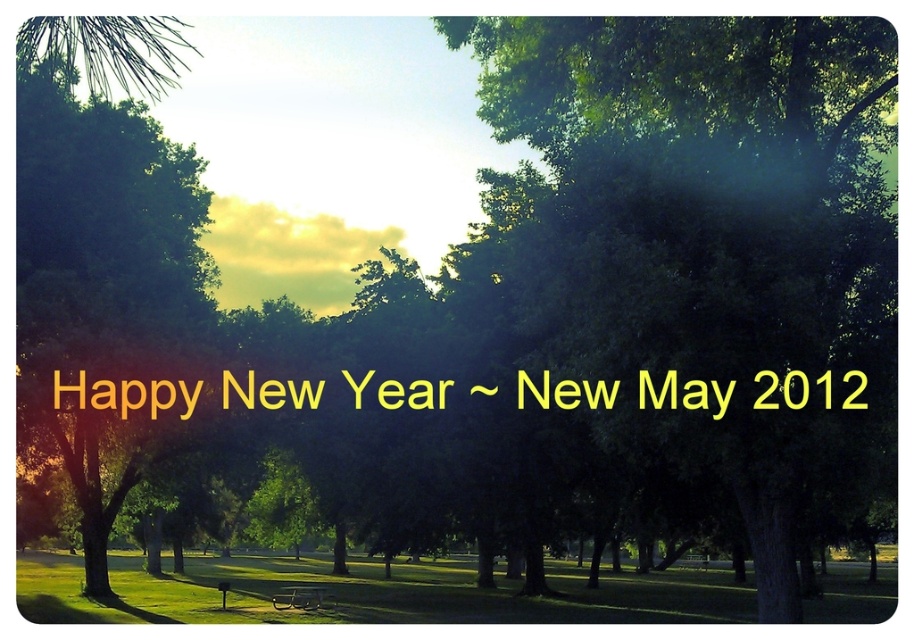
Does yellow metallic text at center lie behind wooden park bench at lower center?

No, it is in front of wooden park bench at lower center.

From the picture: Can you confirm if yellow metallic text at center is smaller than wooden park bench at lower center?

No.

Which is in front, point (126, 380) or point (319, 589)?

Point (126, 380) is in front.

The width and height of the screenshot is (914, 640). Find the location of `yellow metallic text at center`. yellow metallic text at center is located at coordinates (128, 394).